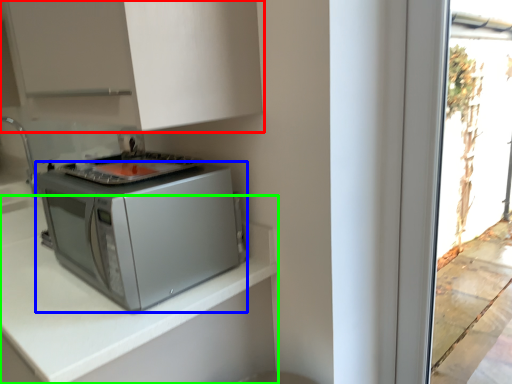
Question: Based on their relative distances, which object is farther from cabinetry (highlighted by a red box)? Choose from home appliance (highlighted by a blue box) and countertop (highlighted by a green box).

Choices:
 (A) home appliance
 (B) countertop

Answer: (B)